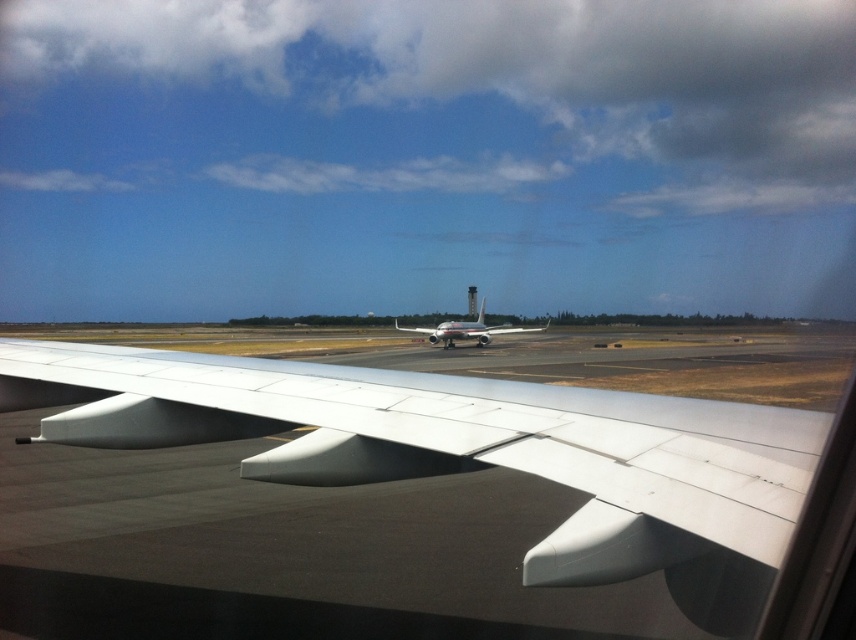
You are a pilot preparing for takeoff and notice two objects in your view from the cockpit window. You see the white matte wing at center and the silver metallic airplane at center. Which object is located to the left of the other?

The white matte wing at center is positioned on the left side of silver metallic airplane at center.

You are a passenger seated near the window of an aircraft. You notice two objects outside your window. The first is the white matte wing at center, and the second is the silver metallic airplane at center. Which object is closer to your seat?

The white matte wing at center is closer to the viewer than the silver metallic airplane at center, so the white matte wing at center is closer to your seat.